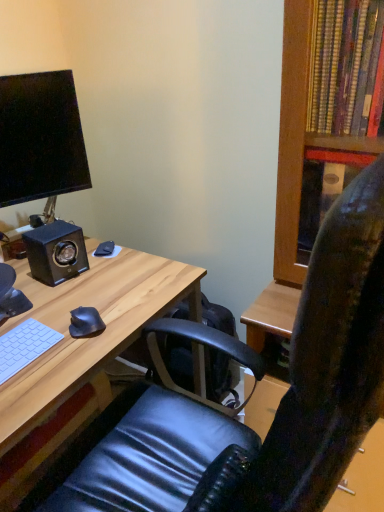
Locate an element on the screen. vacant area that is situated to the right of white matte keyboard at lower left is located at coordinates (66, 357).